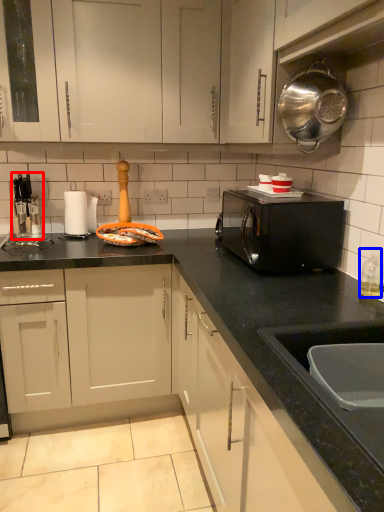
Question: Which object is further to the camera taking this photo, appliance (highlighted by a red box) or bottle (highlighted by a blue box)?

Choices:
 (A) appliance
 (B) bottle

Answer: (A)